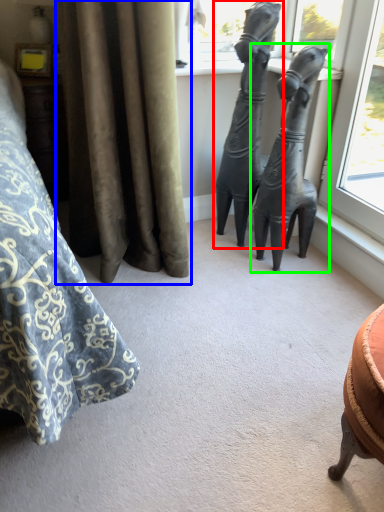
Question: Estimate the real-world distances between objects in this image. Which object is closer to statue (sculpture) (highlighted by a red box), curtain (highlighted by a blue box) or statue (sculpture) (highlighted by a green box)?

Choices:
 (A) curtain
 (B) statue (sculpture)

Answer: (B)